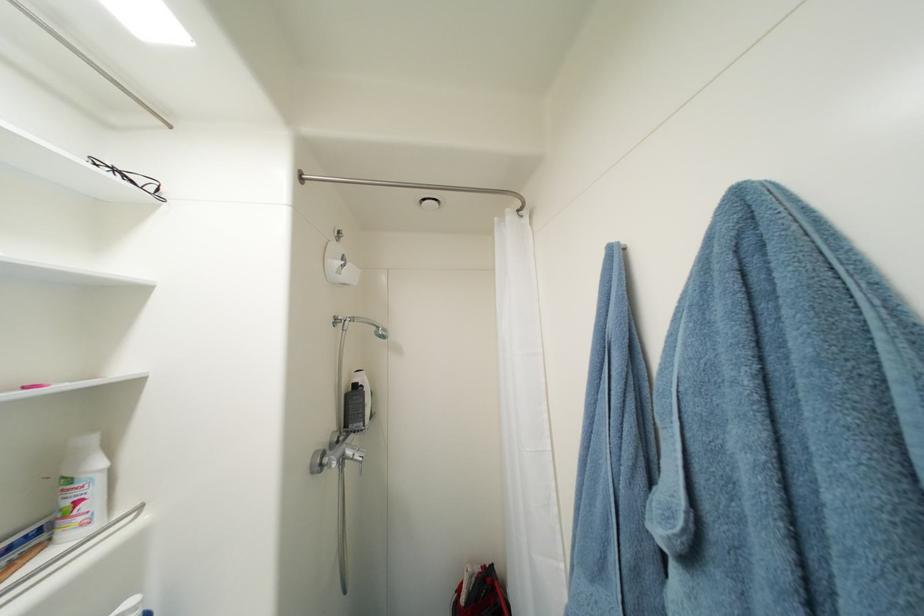
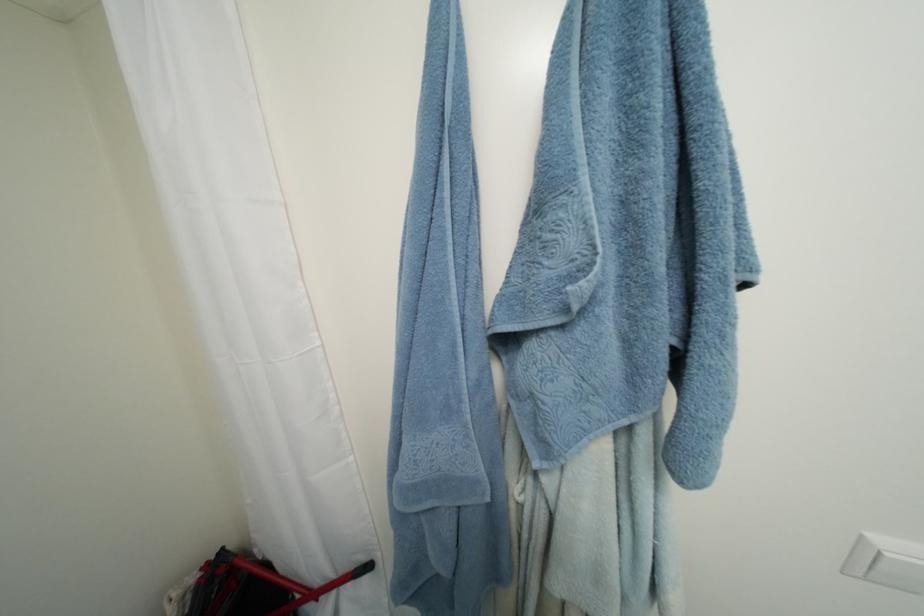
Locate, in the second image, the point that corresponds to the point at 500,567 in the first image.

(229, 552)